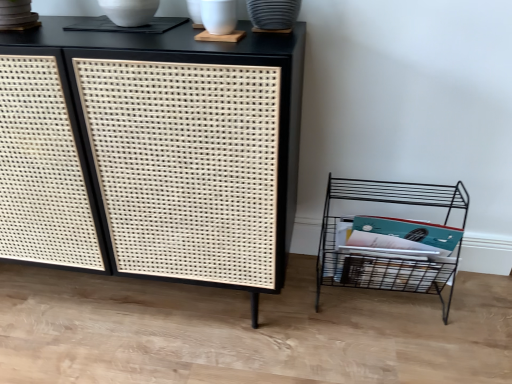
The height and width of the screenshot is (384, 512). I want to click on free space below black wire shelf at lower right (from a real-world perspective), so click(380, 301).